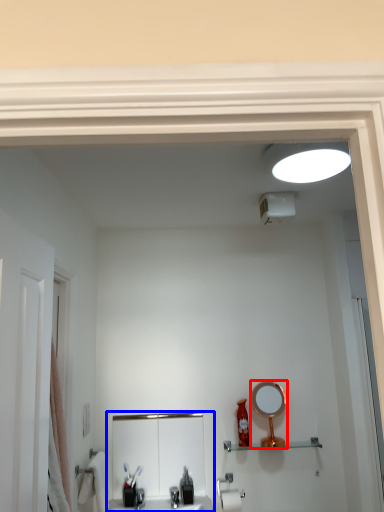
Question: Which object is further to the camera taking this photo, mirror (highlighted by a red box) or sink (highlighted by a blue box)?

Choices:
 (A) mirror
 (B) sink

Answer: (A)